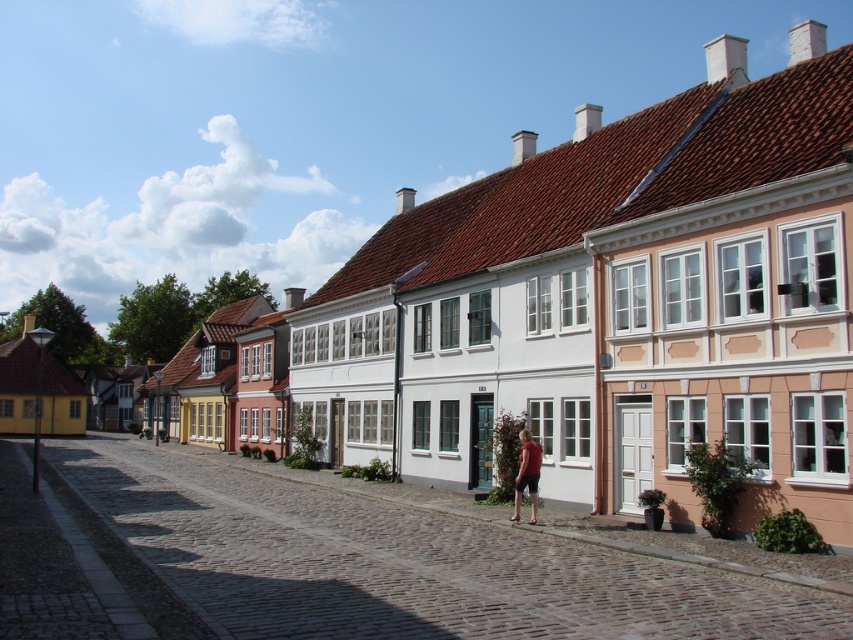
You are standing on the cobblestone street at center and want to give a gift to the person wearing the matte red shirt at center. In which direction should you move to reach them?

The matte red shirt at center is to the right of the cobblestone street at center, so you should move to your right to reach them.

You are a tourist walking on the cobblestone street at center and looking up at the matte red shirt at center. Which object is closer to the ground?

The cobblestone street at center is positioned under the matte red shirt at center, so it is closer to the ground.